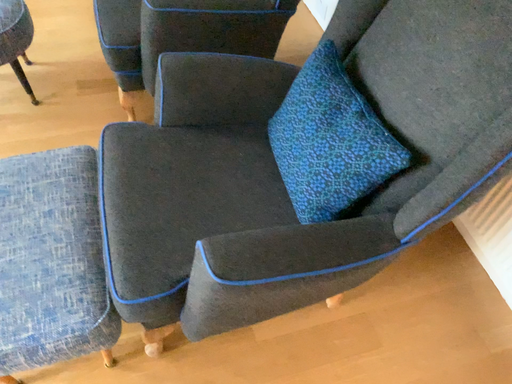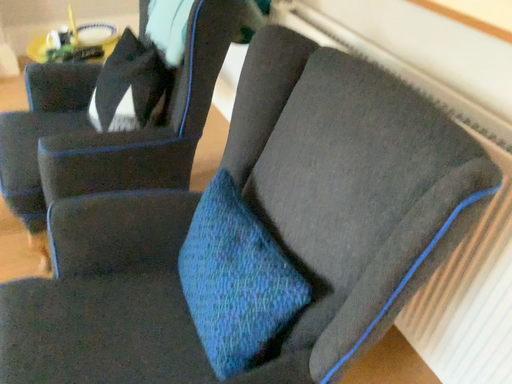
Question: Which way did the camera rotate in the video?

Choices:
 (A) rotated downward
 (B) rotated upward

Answer: (B)